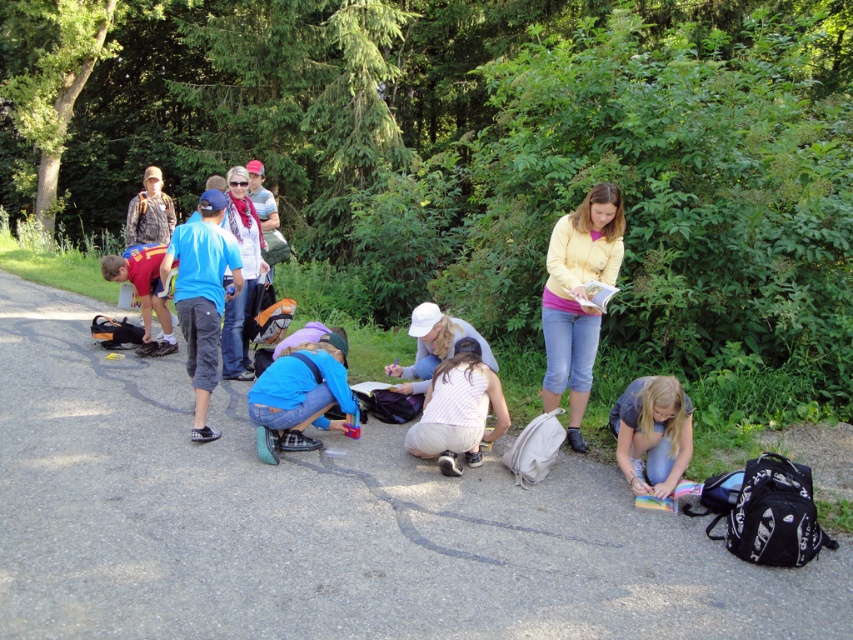
Question: From the image, what is the correct spatial relationship of gray asphalt road at center in relation to denim jeans at lower right?

Choices:
 (A) below
 (B) above

Answer: (A)

Question: From the image, what is the correct spatial relationship of gray asphalt road at center in relation to denim jeans at lower right?

Choices:
 (A) left
 (B) right

Answer: (A)

Question: Considering the relative positions of white striped shirt at center and denim jeans at lower right in the image provided, where is white striped shirt at center located with respect to denim jeans at lower right?

Choices:
 (A) left
 (B) right

Answer: (A)

Question: Which object is farther from the camera taking this photo?

Choices:
 (A) denim jeans at lower right
 (B) matte red shirt at lower left
 (C) white striped shirt at center

Answer: (B)

Question: Estimate the real-world distances between objects in this image. Which object is farther from the blue denim jeans at center?

Choices:
 (A) gray asphalt road at center
 (B) matte red shirt at lower left
 (C) white striped shirt at center

Answer: (B)

Question: Which point appears farthest from the camera in this image?

Choices:
 (A) (469, 381)
 (B) (169, 349)
 (C) (265, 410)

Answer: (B)